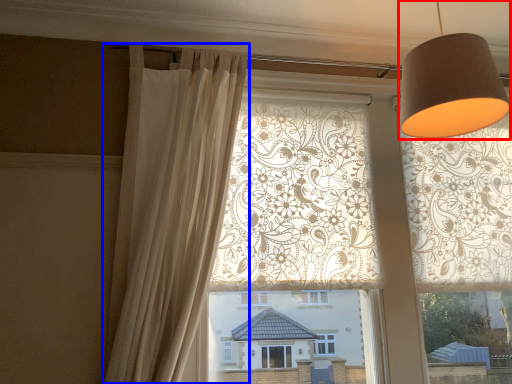
Question: Which object is further to the camera taking this photo, table lamp (highlighted by a red box) or curtain (highlighted by a blue box)?

Choices:
 (A) table lamp
 (B) curtain

Answer: (B)